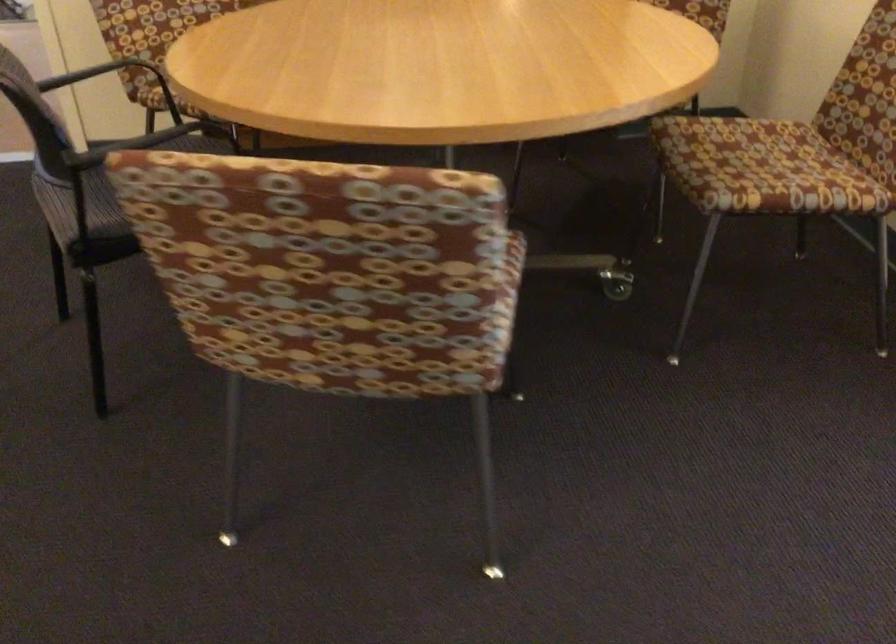
Where would you resting arm the black chair armrest? Please return your answer as a coordinate pair (x, y).

(121, 136)